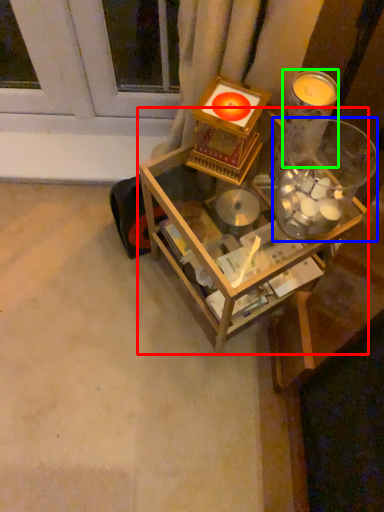
Question: Considering the real-world distances, which object is farthest from table (highlighted by a red box)? glass jar (highlighted by a blue box) or candle holder (highlighted by a green box)?

Choices:
 (A) glass jar
 (B) candle holder

Answer: (B)